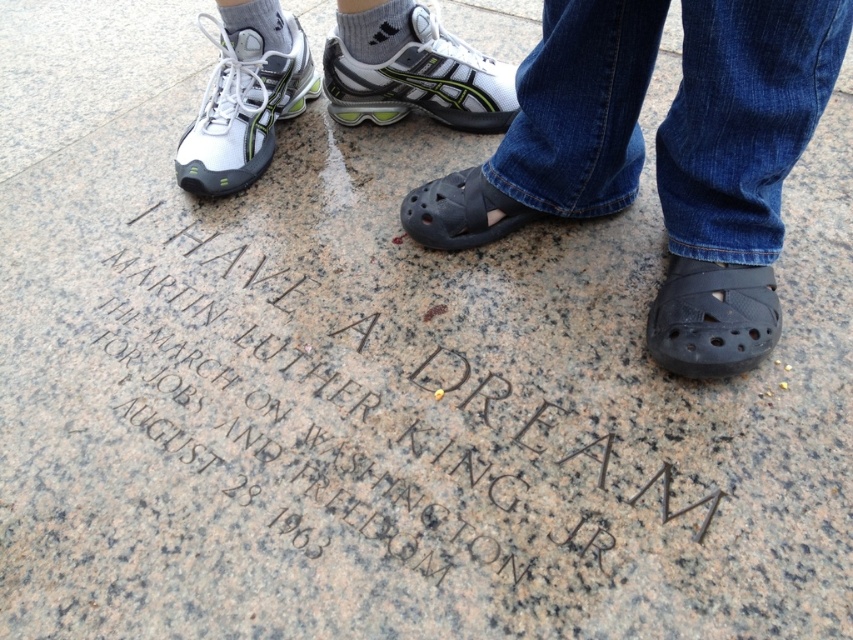
You are a photographer standing at the edge of the granite surface. You want to capture a photo that includes both the white mesh shoe at left and the white mesh shoe at center. What is the minimum distance you need to move backward to ensure both shoes are in frame?

The white mesh shoe at left is 25.64 centimeters away from the white mesh shoe at center. To include both in the photo, you need to move back at least half of that distance, so approximately 12.82 centimeters. However, exact distance depends on camera lens and sensor size.

You are standing 40 inches away from the granite engraving at center. Can you read the text on it without moving closer?

The granite engraving at center is 37.70 inches away from the viewer, so you are currently 2.3 inches too far away to read the text without moving closer.

You are standing in front of a memorial engraving and notice two white mesh shoes. Which one is closer to you, the white mesh shoe at left or the white mesh shoe at center?

The white mesh shoe at left is closer to you because the white mesh shoe at center is behind it.